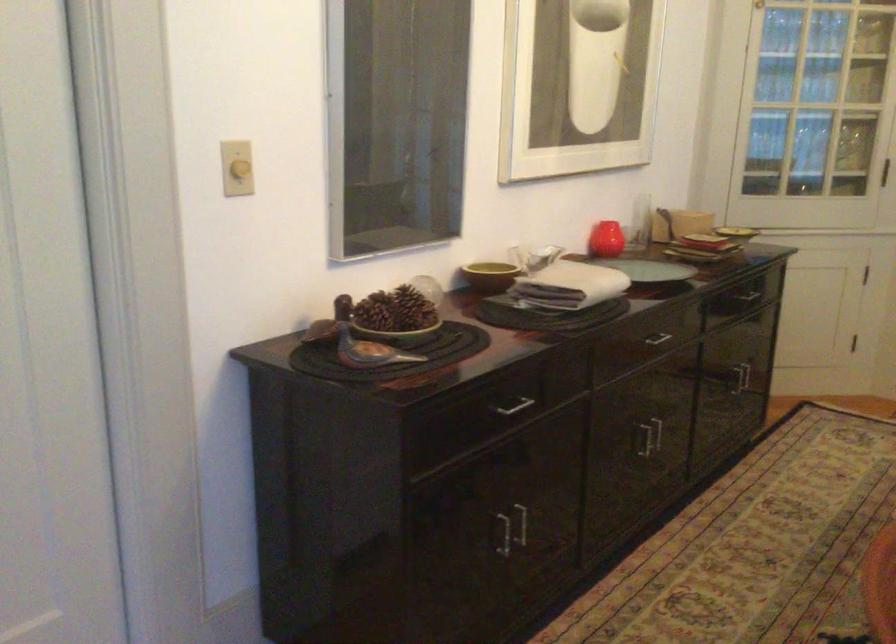
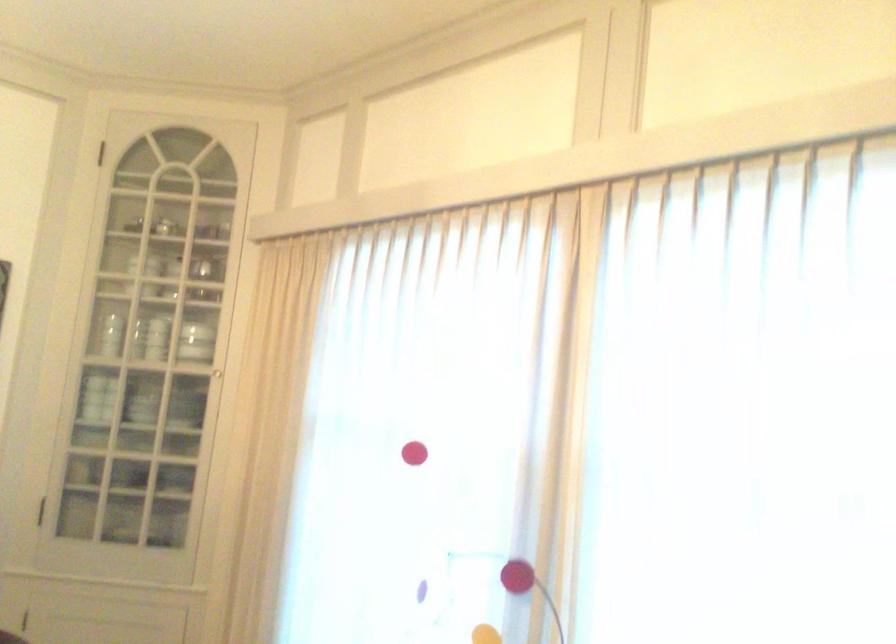
Question: Based on the continuous images, in which direction is the camera rotating? Reply with the corresponding letter.

Choices:
 (A) Left
 (B) Right
 (C) Up
 (D) Down

Answer: (B)